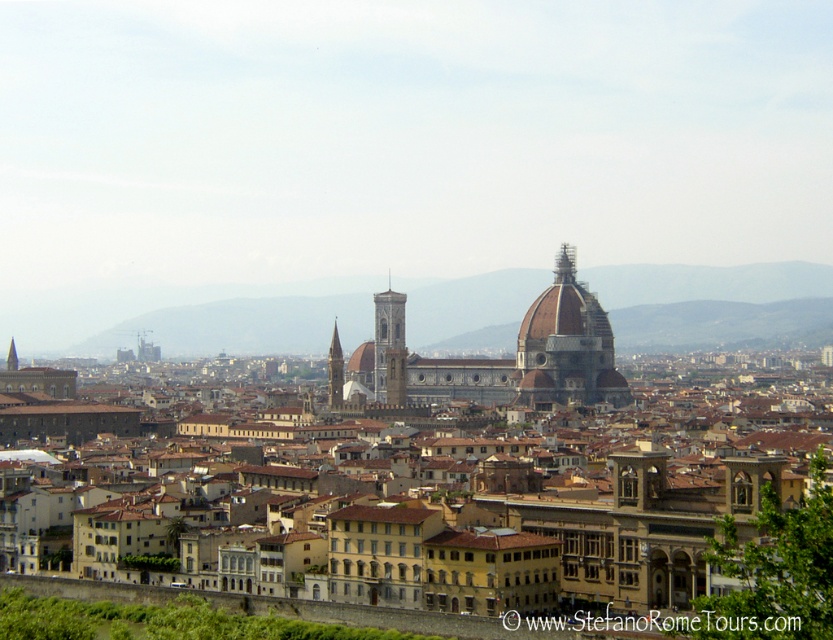
You are a tourist standing at the base of the smooth stone tower at center in Florence. You want to visit the matte gray dome at center. Given that the average walking speed is 3 miles per hour, how many minutes will it take you to walk directly to the dome?

The distance between the matte gray dome at center and the smooth stone tower at center is 221.83 feet. Converting feet to miles, 221.83 feet is approximately 0.042 miles. At a walking speed of 3 mph, the time taken would be distance divided by speed, so 0.042 miles divided by 3 mph equals 0.014 hours. Converting hours to minutes, 0.014 hours multiplied by 60 minutes equals approximately 0.84 minutes, which is roughly 50 seconds. Therefore, it would take about 50 seconds to walk directly to the dome.

You are standing in front of the Florence Cathedral and want to take a photo that includes both the smooth stone bell tower at center and the smooth stone tower at center. Which tower should you position closer to the camera to ensure both are in focus?

To ensure both the smooth stone bell tower at center and the smooth stone tower at center are in focus, position the smooth stone bell tower at center closer to the camera since it is already further away than the smooth stone tower at center.